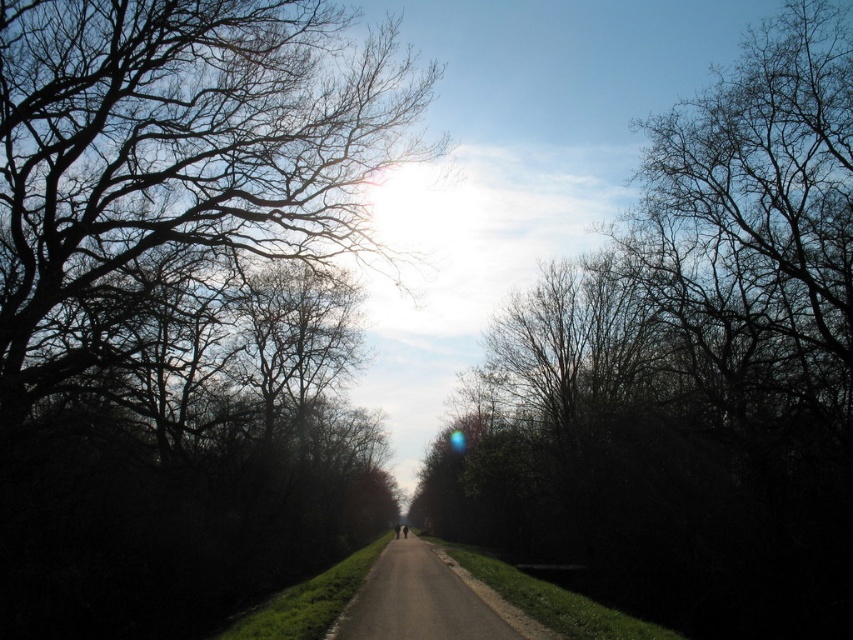
You are standing on the dark asphalt road at center and want to take a photo of the silhouette bare tree at center. Which object is closer to you when you aim your camera?

The silhouette bare tree at center is closer to you than the dark asphalt road at center because it is positioned in front of the road in the scene.

You are standing at the starting point of the road and want to place a bench exactly in the middle of the road. The road is 2 meters wide. Given the silhouette bare tree at center is located at coordinates 0.578, 0.809, can you determine the coordinates where the bench should be placed?

The bench should be placed at the center of the road, which is at coordinates (426, 320). The silhouette bare tree at center is located at (689, 369), so the bench should be placed at (426, 320) to be in the exact middle of the road.

You are standing on the rural road and see the point marked at coordinates (689,369). What does this point represent in the scene?

The point at coordinates (689,369) marks the location of the silhouette bare tree at center.